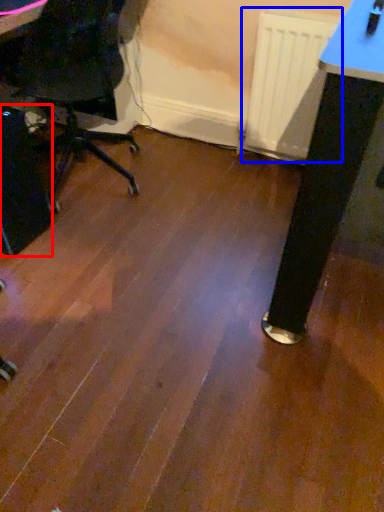
Question: Among these objects, which one is farthest to the camera, computer tower (highlighted by a red box) or radiator (highlighted by a blue box)?

Choices:
 (A) computer tower
 (B) radiator

Answer: (B)